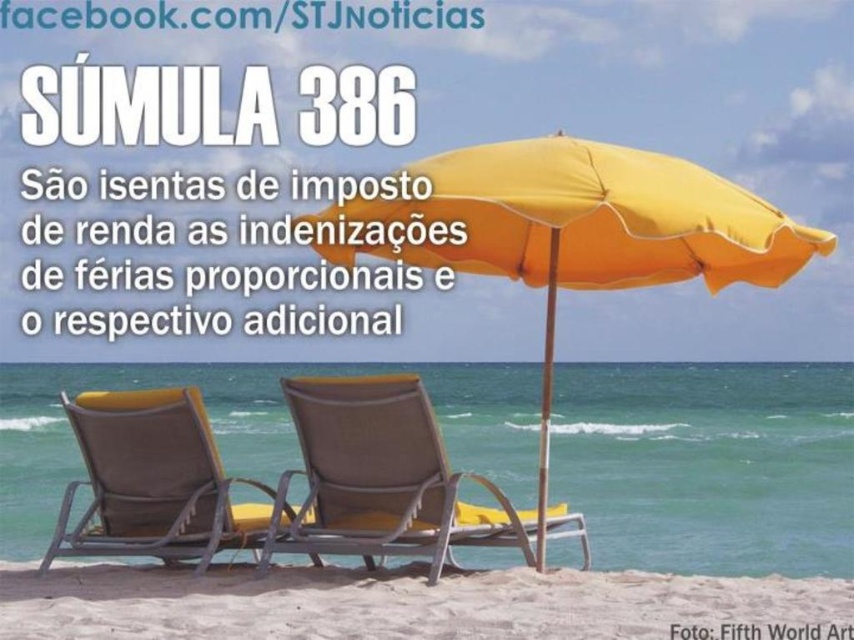
You are a photographer standing at the camera position. You want to capture a closeup shot of the yellow fabric umbrella at center. Given that your camera has a maximum zoom range of 5 meters, will you be able to take the photo without moving closer?

The distance between the yellow fabric umbrella at center and the camera is 7.12 meters. Since the camera can only zoom up to 5 meters, you cannot take the closeup shot without moving closer.

You are a lifeguard standing at the point labeled point (794, 582). You need to reach the ocean quickly. Which direction should you move to get to the water fastest?

Since the ocean is in the center of the image and the point (794, 582) is on the sandy shore, you should move towards the ocean in the direction opposite the beach umbrella and lounge chairs to reach the water fastest.